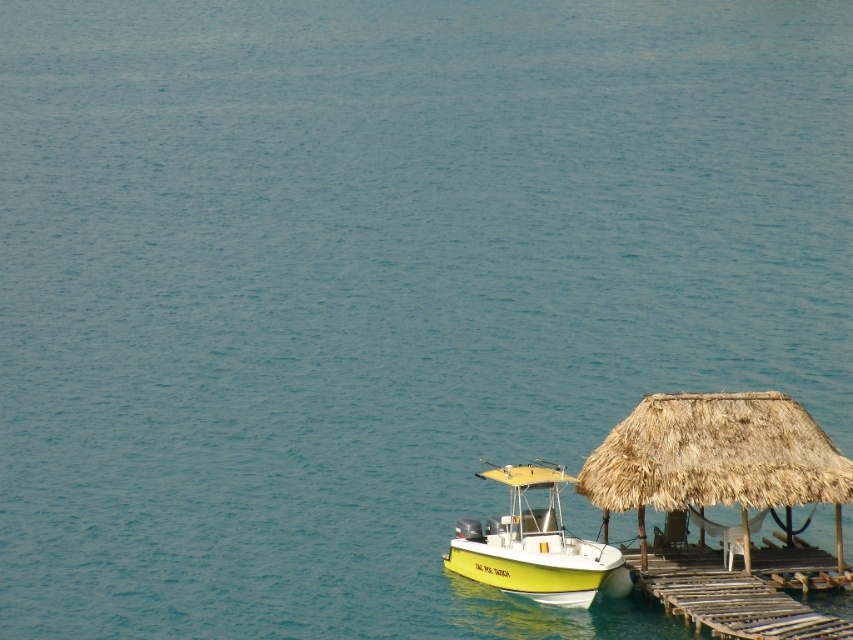
Question: Does yellow matte boat at lower right appear on the right side of wooden planks dock at lower right?

Choices:
 (A) yes
 (B) no

Answer: (B)

Question: Can you confirm if yellow matte boat at lower right is smaller than wooden planks dock at lower right?

Choices:
 (A) no
 (B) yes

Answer: (A)

Question: Does yellow matte boat at lower right appear on the right side of wooden planks dock at lower right?

Choices:
 (A) yes
 (B) no

Answer: (B)